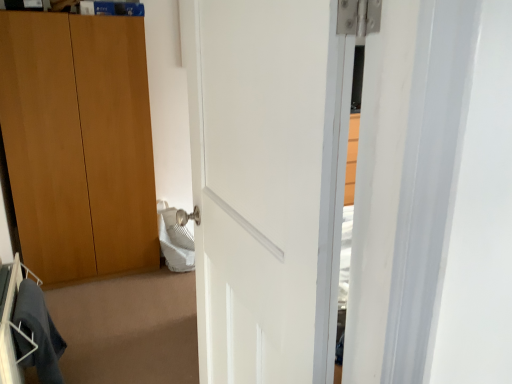
Question: Is dark gray fabric at lower left to the left or to the right of white glossy door at center in the image?

Choices:
 (A) left
 (B) right

Answer: (A)

Question: Which is correct: dark gray fabric at lower left is inside white glossy door at center, or outside of it?

Choices:
 (A) outside
 (B) inside

Answer: (A)

Question: From the image's perspective, is dark gray fabric at lower left positioned above or below white glossy door at center?

Choices:
 (A) below
 (B) above

Answer: (A)

Question: From a real-world perspective, relative to dark gray fabric at lower left, is white glossy door at center vertically above or below?

Choices:
 (A) above
 (B) below

Answer: (A)

Question: Would you say white glossy door at center is to the left or to the right of dark gray fabric at lower left in the picture?

Choices:
 (A) left
 (B) right

Answer: (B)

Question: In terms of height, does white glossy door at center look taller or shorter compared to dark gray fabric at lower left?

Choices:
 (A) short
 (B) tall

Answer: (B)

Question: Considering the positions of white glossy door at center and dark gray fabric at lower left in the image, is white glossy door at center wider or thinner than dark gray fabric at lower left?

Choices:
 (A) wide
 (B) thin

Answer: (A)